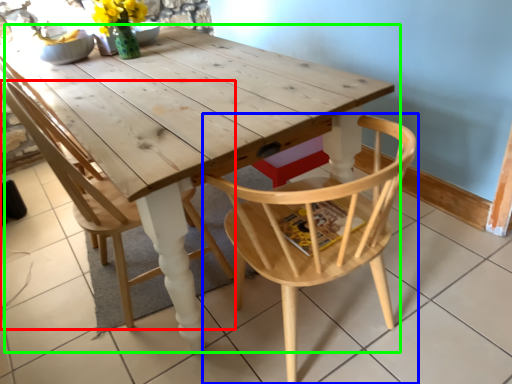
Question: Which is nearer to the chair (highlighted by a red box)? chair (highlighted by a blue box) or table (highlighted by a green box).

Choices:
 (A) chair
 (B) table

Answer: (B)